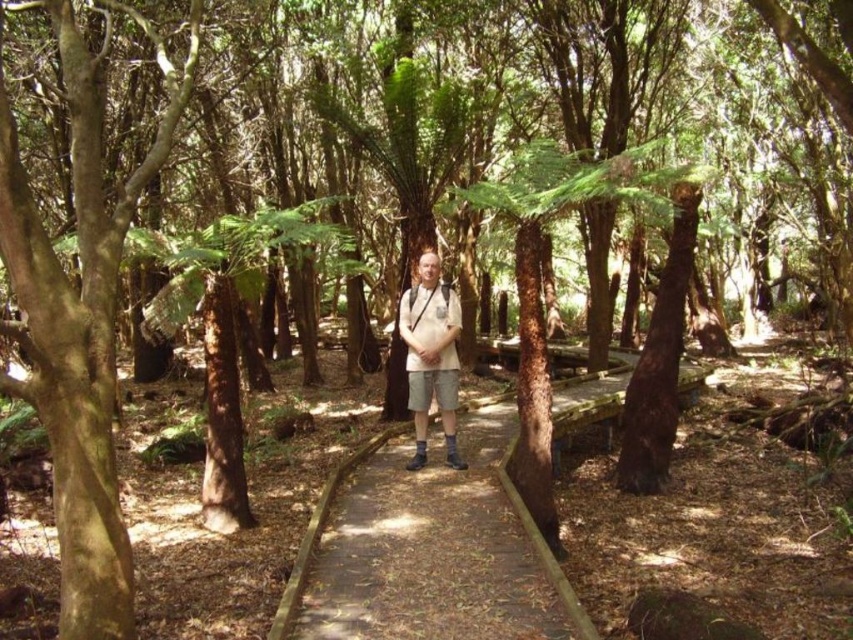
Question: Which of the following is the farthest from the observer?

Choices:
 (A) brown rough bark tree at left
 (B) wooden boardwalk at center
 (C) white cotton shirt at center

Answer: (C)

Question: Among these points, which one is farthest from the camera?

Choices:
 (A) (339, 621)
 (B) (412, 296)
 (C) (117, 552)

Answer: (B)

Question: Considering the real-world distances, which object is farthest from the wooden boardwalk at center?

Choices:
 (A) brown rough bark tree at left
 (B) white cotton shirt at center

Answer: (A)

Question: Does wooden boardwalk at center come in front of white cotton shirt at center?

Choices:
 (A) yes
 (B) no

Answer: (A)

Question: Is brown rough bark tree at left further to the viewer compared to wooden boardwalk at center?

Choices:
 (A) no
 (B) yes

Answer: (A)

Question: Is brown rough bark tree at left thinner than white cotton shirt at center?

Choices:
 (A) yes
 (B) no

Answer: (B)